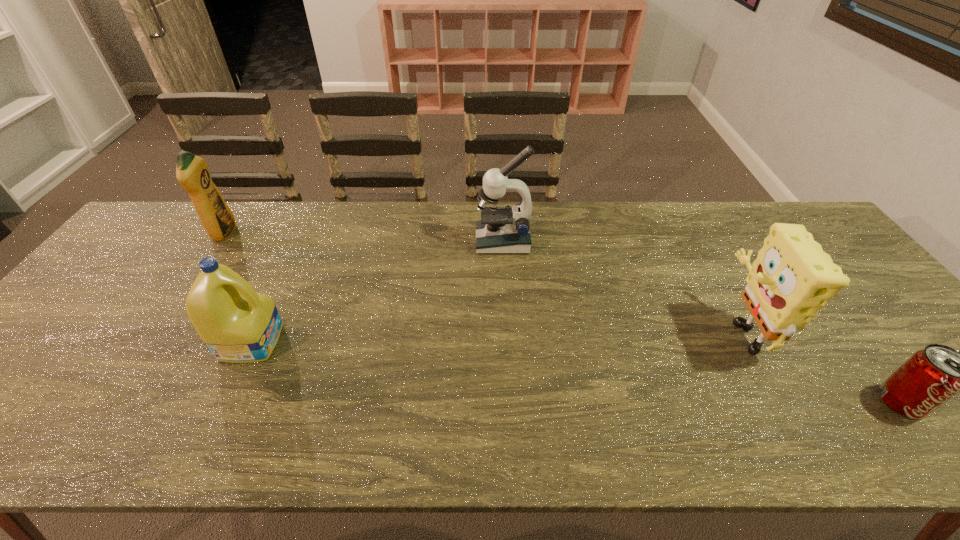
You are a GUI agent. You are given a task and a screenshot of the screen. Output one action in this format:
    pyautogui.click(x=<x>, y=<y>)
    Task: Click on the free point at the far edge
    Image resolution: width=960 pixels, height=540 pixels.
    Given the screenshot: What is the action you would take?
    pyautogui.click(x=462, y=203)

I want to click on vacant space at the near edge of the desktop, so click(76, 430).

You are a GUI agent. You are given a task and a screenshot of the screen. Output one action in this format:
    pyautogui.click(x=<x>, y=<y>)
    Task: Click on the free location at the far left corner
    
    Given the screenshot: What is the action you would take?
    pyautogui.click(x=151, y=247)

In the image, there is a desktop. Where is `vacant space at the far right corner`? The height and width of the screenshot is (540, 960). vacant space at the far right corner is located at coordinates (817, 239).

At what (x,y) coordinates should I click in order to perform the action: click on vacant area that lies between the fourth object from right to left and the microscope. Please return your answer as a coordinate pair (x, y). The image size is (960, 540). Looking at the image, I should click on (377, 291).

Identify the location of vacant space that's between the second object from right to left and the rightmost object. Image resolution: width=960 pixels, height=540 pixels. (820, 366).

Locate an element on the screen. free space between the nearest object and the second object from right to left is located at coordinates (820, 366).

This screenshot has width=960, height=540. Find the location of `free space between the rightmost object and the right detergent`. free space between the rightmost object and the right detergent is located at coordinates (576, 372).

This screenshot has width=960, height=540. In order to click on free space between the sponge and the shortest object in this screenshot , I will do `click(820, 366)`.

This screenshot has height=540, width=960. I want to click on vacant space in between the shortest object and the farther detergent, so click(x=563, y=318).